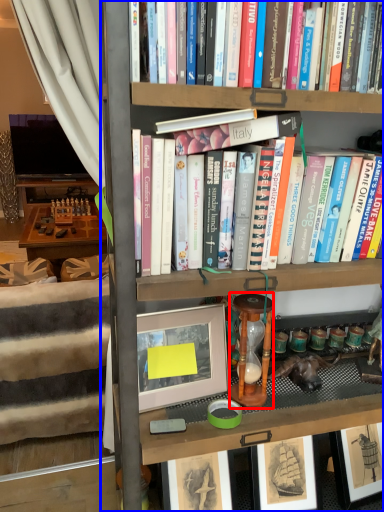
Question: Which point is closer to the camera, stool (highlighted by a red box) or bookcase (highlighted by a blue box)?

Choices:
 (A) stool
 (B) bookcase

Answer: (B)